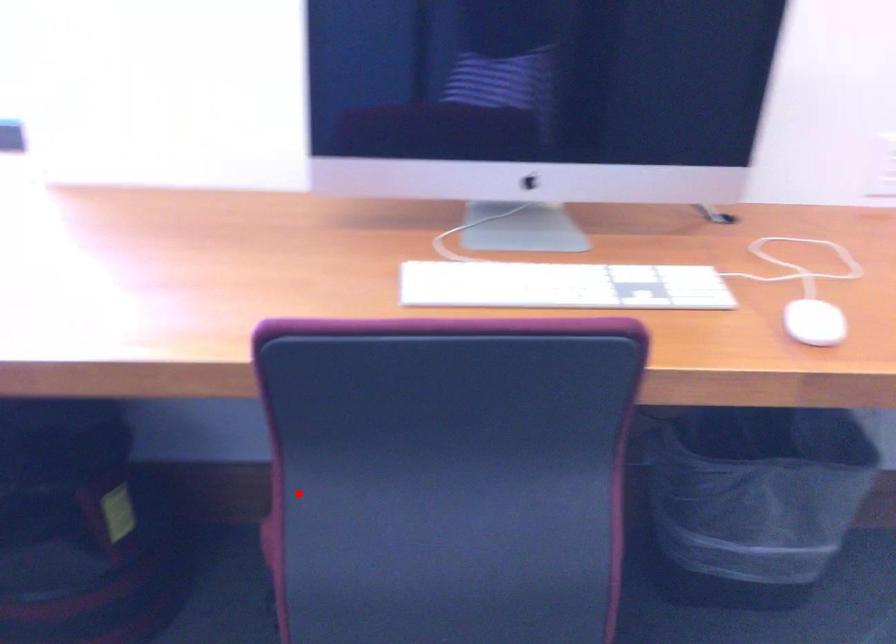
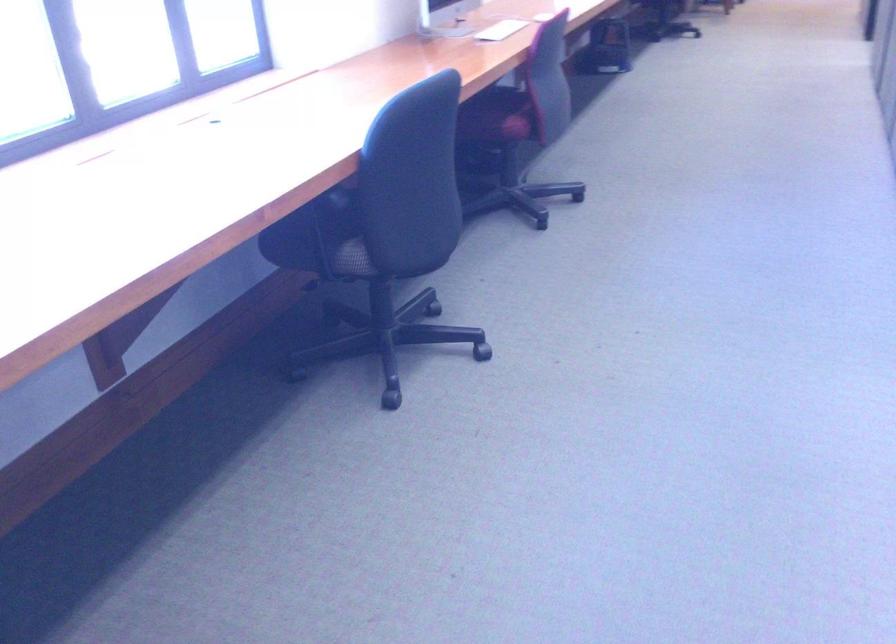
Question: A red point is marked in image1. In image2, is the corresponding 3D point closer to the camera or farther? Reply with the corresponding letter.

Choices:
 (A) The corresponding 3D point is closer.
 (B) The corresponding 3D point is farther.

Answer: (B)